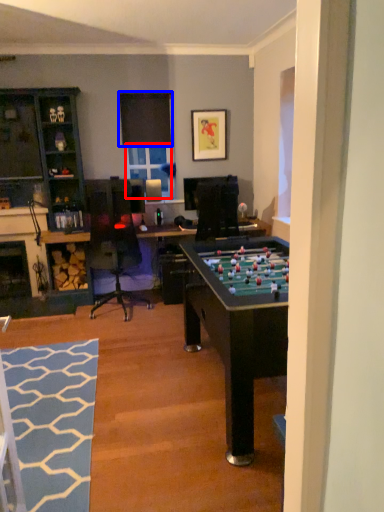
Question: Which point is further to the camera, window screen (highlighted by a red box) or window screen (highlighted by a blue box)?

Choices:
 (A) window screen
 (B) window screen

Answer: (A)